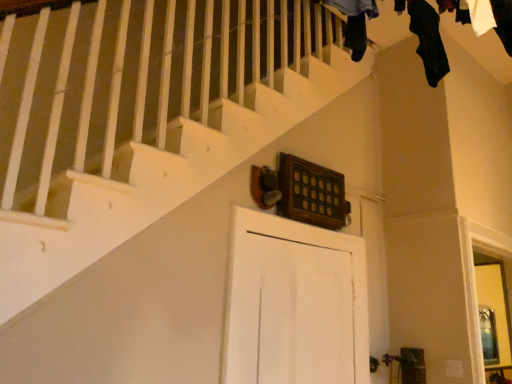
The width and height of the screenshot is (512, 384). Find the location of `black fabric at upper center, the 1th clothing viewed from the front`. black fabric at upper center, the 1th clothing viewed from the front is located at coordinates (355, 23).

Where is `black fabric at upper right, the 2th clothing from the front`? black fabric at upper right, the 2th clothing from the front is located at coordinates (428, 40).

What do you see at coordinates (294, 304) in the screenshot? This screenshot has width=512, height=384. I see `white matte door at center` at bounding box center [294, 304].

I want to click on black fabric at upper center, which is counted as the second clothing, starting from the right, so click(x=355, y=23).

How different are the orientations of black fabric at upper right, the 2th clothing from the front, and white matte door at center in degrees?

There is a 0.209-degree angle between the facing directions of black fabric at upper right, the 2th clothing from the front, and white matte door at center.

From a real-world perspective, relative to white matte door at center, is black fabric at upper right, the 2th clothing from the front, vertically above or below?

Clearly, from a real-world perspective, black fabric at upper right, the 2th clothing from the front, is above white matte door at center.

Is black fabric at upper right, the 1th clothing in the back-to-front sequence, turned away from white matte door at center?

black fabric at upper right, the 1th clothing in the back-to-front sequence, is not turned away from white matte door at center.

Does black fabric at upper right, the 2th clothing from the front, have a lesser height compared to white matte door at center?

Yes.

Which object is wider, black fabric at upper center, positioned as the first clothing in left-to-right order, or white matte door at center?

Wider between the two is black fabric at upper center, positioned as the first clothing in left-to-right order.

Is black fabric at upper center, arranged as the second clothing when viewed from the back, outside of white matte door at center?

black fabric at upper center, arranged as the second clothing when viewed from the back, is positioned outside white matte door at center.

Are black fabric at upper center, the 1th clothing viewed from the front, and white matte door at center far apart?

black fabric at upper center, the 1th clothing viewed from the front, is far away from white matte door at center.

Between black fabric at upper center, arranged as the second clothing when viewed from the back, and white matte door at center, which one is positioned in front?

black fabric at upper center, arranged as the second clothing when viewed from the back, is closer to the camera.

Considering the sizes of objects white matte door at center and black fabric at upper right, arranged as the 2th clothing when viewed from the left, in the image provided, who is bigger, white matte door at center or black fabric at upper right, arranged as the 2th clothing when viewed from the left,?

Bigger between the two is white matte door at center.

From the image's perspective, is white matte door at center beneath black fabric at upper right, the 1th clothing in the back-to-front sequence?

Indeed, from the image's perspective, white matte door at center is shown beneath black fabric at upper right, the 1th clothing in the back-to-front sequence.

From a real-world perspective, which is physically below, white matte door at center or black fabric at upper right, arranged as the 2th clothing when viewed from the left?

white matte door at center, from a real-world perspective.

Considering the positions of objects white matte door at center and black fabric at upper center, positioned as the first clothing in left-to-right order, in the image provided, who is more to the left, white matte door at center or black fabric at upper center, positioned as the first clothing in left-to-right order,?

From the viewer's perspective, white matte door at center appears more on the left side.

Considering the relative sizes of white matte door at center and black fabric at upper center, which is counted as the second clothing, starting from the right, in the image provided, is white matte door at center taller than black fabric at upper center, which is counted as the second clothing, starting from the right,?

Correct, white matte door at center is much taller as black fabric at upper center, which is counted as the second clothing, starting from the right.

From the image's perspective, which is above, white matte door at center or black fabric at upper center, the 1th clothing viewed from the front?

black fabric at upper center, the 1th clothing viewed from the front, from the image's perspective.

Considering the relative positions of black fabric at upper center, arranged as the second clothing when viewed from the back, and black fabric at upper right, the 2th clothing from the front, in the image provided, is black fabric at upper center, arranged as the second clothing when viewed from the back, in front of black fabric at upper right, the 2th clothing from the front,?

Yes, it is.

Does black fabric at upper center, the 1th clothing viewed from the front, have a lesser height compared to black fabric at upper right, the 2th clothing from the front?

Indeed, black fabric at upper center, the 1th clothing viewed from the front, has a lesser height compared to black fabric at upper right, the 2th clothing from the front.

Is black fabric at upper center, which is counted as the second clothing, starting from the right, turned away from black fabric at upper right, the 2th clothing from the front?

No.

Considering the sizes of objects black fabric at upper center, which is counted as the second clothing, starting from the right, and black fabric at upper right, the 1th clothing in the back-to-front sequence, in the image provided, who is thinner, black fabric at upper center, which is counted as the second clothing, starting from the right, or black fabric at upper right, the 1th clothing in the back-to-front sequence,?

black fabric at upper right, the 1th clothing in the back-to-front sequence, is thinner.

Is black fabric at upper right, the 2th clothing from the front, taller than black fabric at upper center, positioned as the first clothing in left-to-right order?

Indeed, black fabric at upper right, the 2th clothing from the front, has a greater height compared to black fabric at upper center, positioned as the first clothing in left-to-right order.

Is black fabric at upper right, the 1th clothing in the back-to-front sequence, at the left side of black fabric at upper center, positioned as the first clothing in left-to-right order?

Incorrect, black fabric at upper right, the 1th clothing in the back-to-front sequence, is not on the left side of black fabric at upper center, positioned as the first clothing in left-to-right order.

What's the angular difference between black fabric at upper right, acting as the 1th clothing starting from the right, and black fabric at upper center, which is counted as the second clothing, starting from the right,'s facing directions?

They differ by 0.000158 degrees in their facing directions.

Is black fabric at upper center, arranged as the second clothing when viewed from the back, a part of black fabric at upper right, the 2th clothing from the front?

Definitely not — black fabric at upper center, arranged as the second clothing when viewed from the back, is not inside black fabric at upper right, the 2th clothing from the front.

Where is `door that appears in front of the black fabric at upper right, the 1th clothing in the back-to-front sequence`? door that appears in front of the black fabric at upper right, the 1th clothing in the back-to-front sequence is located at coordinates (294, 304).

Image resolution: width=512 pixels, height=384 pixels. What are the coordinates of `door behind the black fabric at upper center, which is counted as the second clothing, starting from the right` in the screenshot? It's located at (294, 304).

Based on their spatial positions, is white matte door at center or black fabric at upper center, positioned as the first clothing in left-to-right order, further from black fabric at upper right, the 2th clothing from the front?

white matte door at center lies further to black fabric at upper right, the 2th clothing from the front, than the other object.

Looking at the image, which one is located closer to black fabric at upper center, positioned as the first clothing in left-to-right order, black fabric at upper right, the 1th clothing in the back-to-front sequence, or white matte door at center?

black fabric at upper right, the 1th clothing in the back-to-front sequence, is closer to black fabric at upper center, positioned as the first clothing in left-to-right order.

Estimate the real-world distances between objects in this image. Which object is further from white matte door at center, black fabric at upper right, the 2th clothing from the front, or black fabric at upper center, positioned as the first clothing in left-to-right order?

black fabric at upper right, the 2th clothing from the front, lies further to white matte door at center than the other object.

Estimate the real-world distances between objects in this image. Which object is closer to black fabric at upper center, which is counted as the second clothing, starting from the right, white matte door at center or black fabric at upper right, arranged as the 2th clothing when viewed from the left?

The object closer to black fabric at upper center, which is counted as the second clothing, starting from the right, is black fabric at upper right, arranged as the 2th clothing when viewed from the left.

Estimate the real-world distances between objects in this image. Which object is further from black fabric at upper right, acting as the 1th clothing starting from the right, black fabric at upper center, positioned as the first clothing in left-to-right order, or white matte door at center?

Among the two, white matte door at center is located further to black fabric at upper right, acting as the 1th clothing starting from the right.

Based on their spatial positions, is black fabric at upper center, positioned as the first clothing in left-to-right order, or black fabric at upper right, the 1th clothing in the back-to-front sequence, further from white matte door at center?

Among the two, black fabric at upper right, the 1th clothing in the back-to-front sequence, is located further to white matte door at center.

I want to click on clothing between black fabric at upper right, acting as the 1th clothing starting from the right, and white matte door at center in the up-down direction, so click(355, 23).